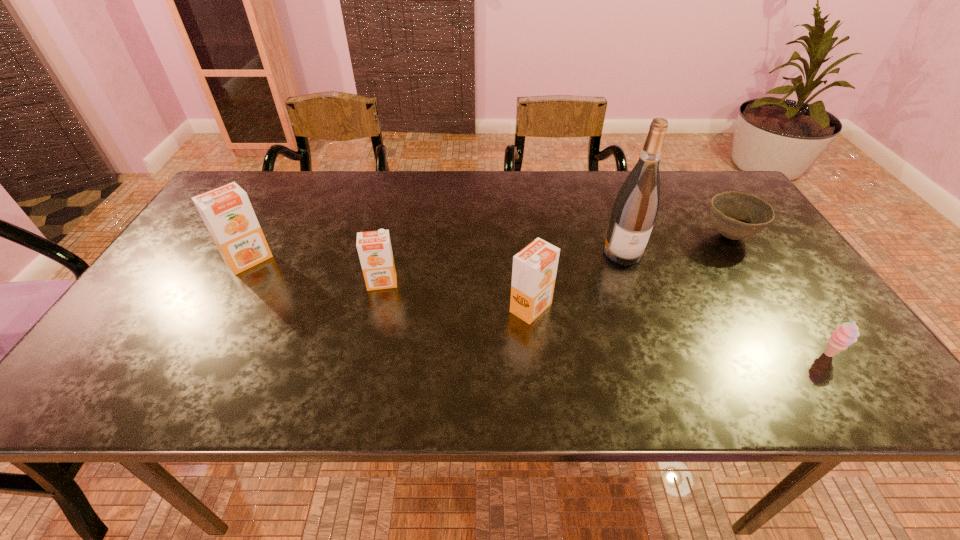
Find the location of a particular element. free space located 0.210m on the right of the shortest orange juice is located at coordinates [x=483, y=282].

This screenshot has width=960, height=540. Find the location of `vacant space located 0.230m on the back of the second nearest object`. vacant space located 0.230m on the back of the second nearest object is located at coordinates (522, 233).

The image size is (960, 540). Find the location of `vacant area situated 0.290m on the left of the bowl`. vacant area situated 0.290m on the left of the bowl is located at coordinates (595, 236).

At what (x,y) coordinates should I click in order to perform the action: click on vacant area situated on the label of the tallest object. Please return your answer as a coordinate pair (x, y). The height and width of the screenshot is (540, 960). Looking at the image, I should click on (633, 280).

At what (x,y) coordinates should I click in order to perform the action: click on vacant space situated 0.060m on the back of the nearest object. Please return your answer as a coordinate pair (x, y). The height and width of the screenshot is (540, 960). Looking at the image, I should click on point(808,326).

Image resolution: width=960 pixels, height=540 pixels. Identify the location of object positioned at the near edge. (844, 335).

Locate an element on the screen. object that is at the left edge is located at coordinates (227, 212).

This screenshot has width=960, height=540. I want to click on bowl located at the right edge, so click(736, 215).

I want to click on sherbert located at the right edge, so click(x=844, y=335).

You are a GUI agent. You are given a task and a screenshot of the screen. Output one action in this format:
    pyautogui.click(x=<x>, y=<y>)
    Task: Click on the object located in the near right corner section of the desktop
    
    Given the screenshot: What is the action you would take?
    pyautogui.click(x=844, y=335)